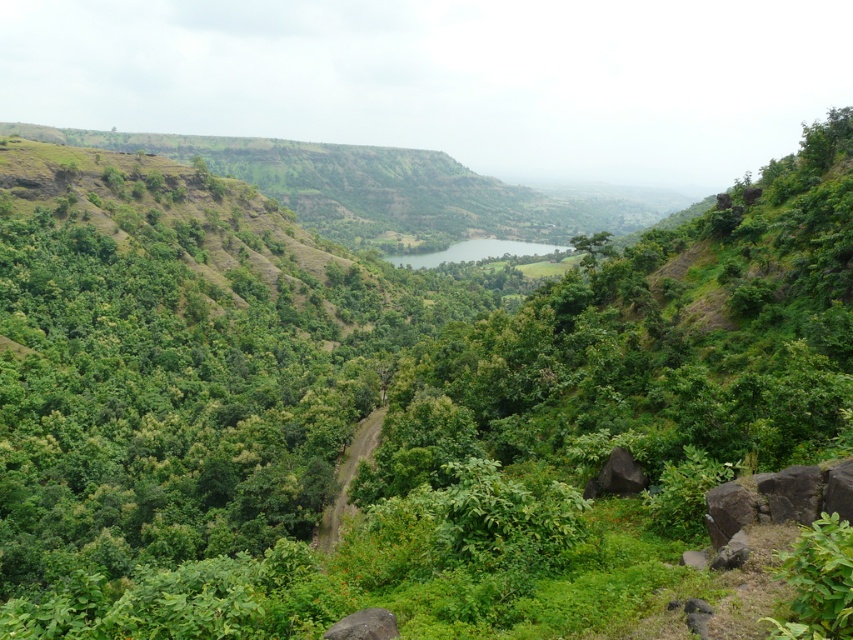
Does dirt/gravel trail at center have a larger size compared to green smooth lake at center?

No.

Is point (346, 492) closer to camera compared to point (524, 248)?

That is True.

At what (x,y) coordinates should I click in order to perform the action: click on dirt/gravel trail at center. Please return your answer as a coordinate pair (x, y). The height and width of the screenshot is (640, 853). Looking at the image, I should click on click(x=347, y=480).

Between point (343, 474) and point (363, 618), which one is positioned in front?

Point (363, 618) is in front.

Find the location of `dirt/gravel trail at center`. dirt/gravel trail at center is located at coordinates pos(347,480).

This screenshot has height=640, width=853. What do you see at coordinates (347, 480) in the screenshot? I see `dirt/gravel trail at center` at bounding box center [347, 480].

I want to click on dirt/gravel trail at center, so click(x=347, y=480).

Find the location of `green smooth lake at center`. green smooth lake at center is located at coordinates (473, 252).